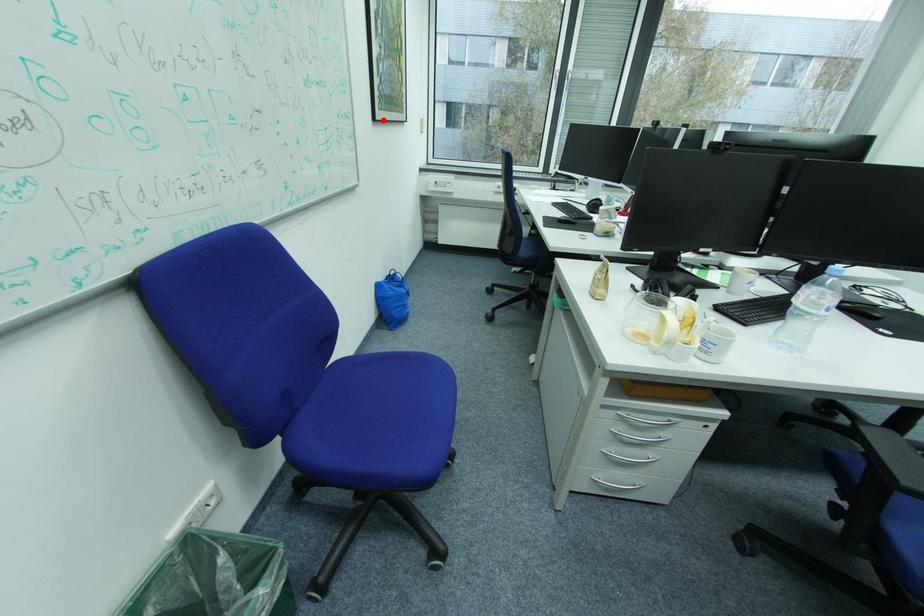
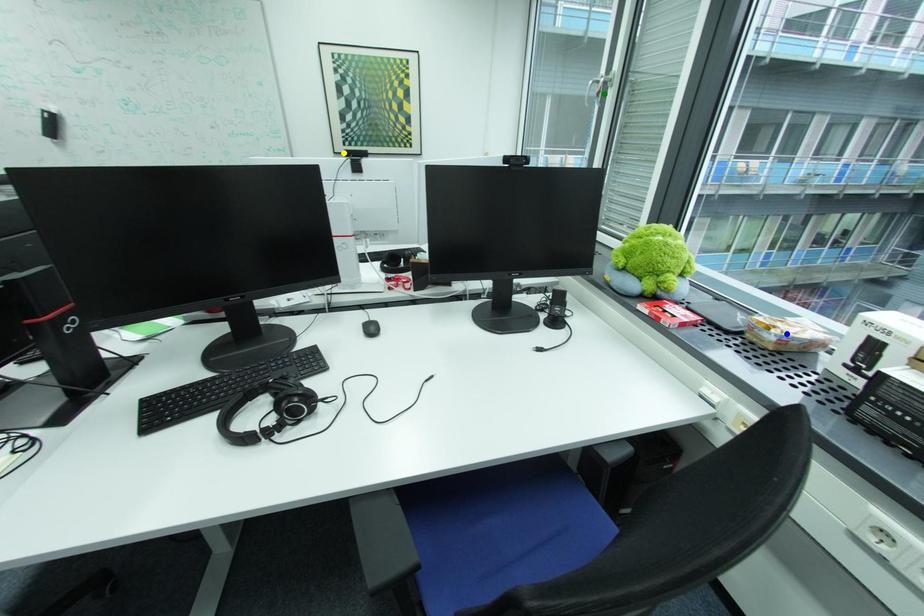
Question: I am providing you with two images of the same scene from different viewpoints. A red point is marked on the first image. You are given multiple points on the second image. Can you choose the point in image 2 that corresponds to the point in image 1?

Choices:
 (A) blue point
 (B) green point
 (C) yellow point

Answer: (C)